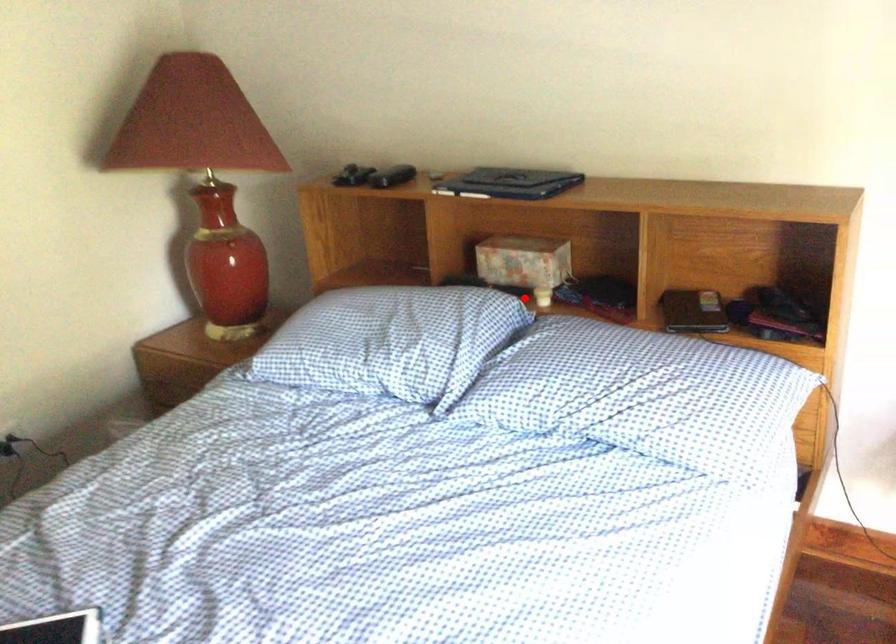
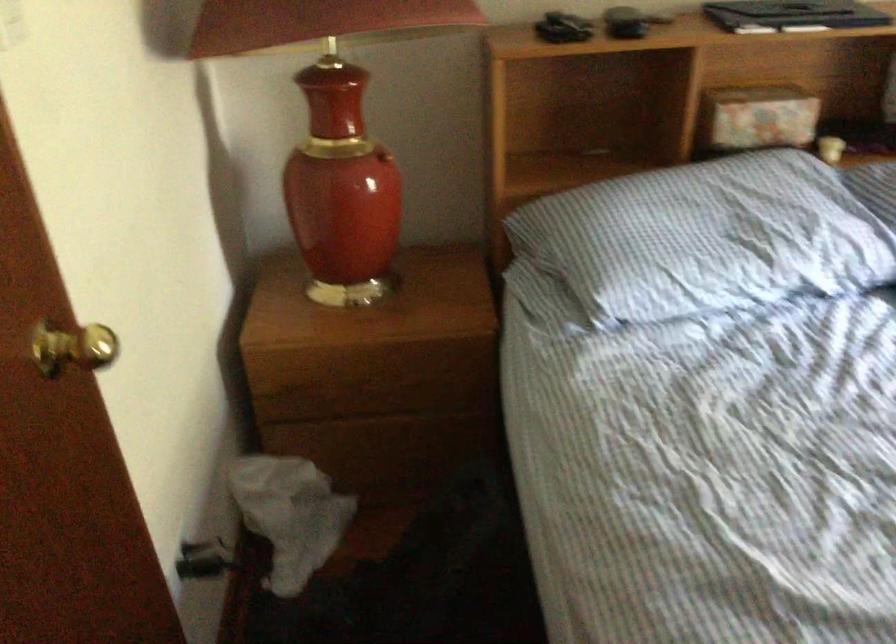
Locate, in the second image, the point that corresponds to the highlighted location in the first image.

(830, 149)